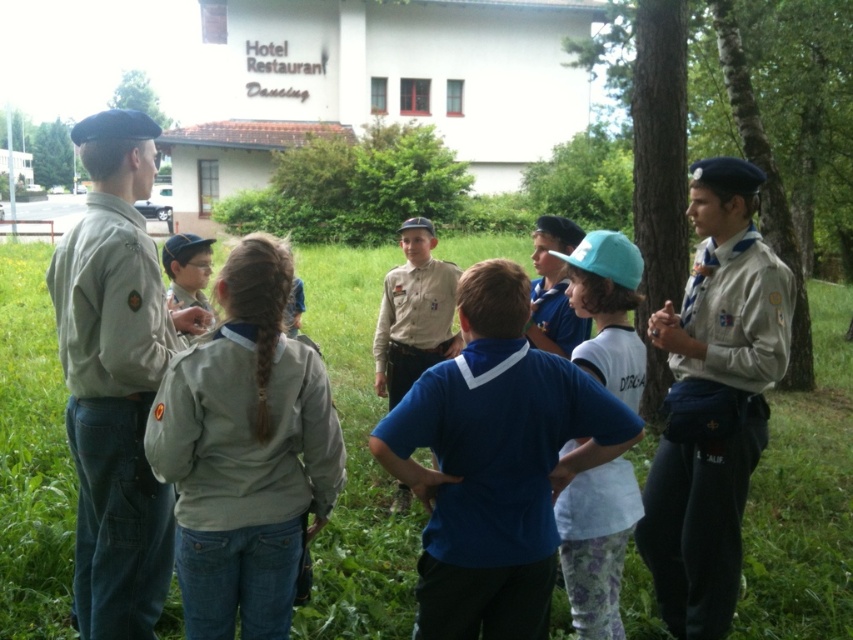
Question: Considering the relative positions of khaki fabric uniform at left and white cotton shirt at center in the image provided, where is khaki fabric uniform at left located with respect to white cotton shirt at center?

Choices:
 (A) above
 (B) below

Answer: (A)

Question: Which of these objects is positioned closest to the khaki uniform at center?

Choices:
 (A) white cotton shirt at center
 (B) light brown fabric uniform at right

Answer: (B)

Question: Which object appears closest to the camera in this image?

Choices:
 (A) light brown fabric uniform at right
 (B) khaki fabric uniform at left
 (C) khaki fabric uniform at center

Answer: (C)

Question: In this image, where is khaki fabric uniform at center located relative to khaki uniform at center?

Choices:
 (A) left
 (B) right

Answer: (A)

Question: Does blue cotton shirt at center appear on the right side of khaki fabric uniform at left?

Choices:
 (A) no
 (B) yes

Answer: (B)

Question: Which object appears closest to the camera in this image?

Choices:
 (A) khaki fabric uniform at left
 (B) khaki fabric uniform at center
 (C) blue cotton shirt at center

Answer: (C)